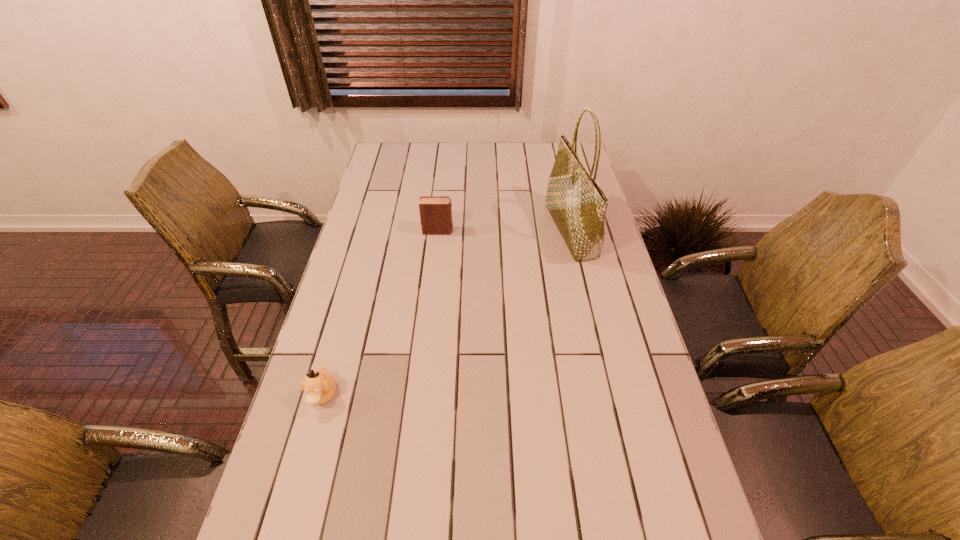
Where is `empty space between the diary and the tallest object`? empty space between the diary and the tallest object is located at coordinates (504, 231).

You are a GUI agent. You are given a task and a screenshot of the screen. Output one action in this format:
    pyautogui.click(x=<x>, y=<y>)
    Task: Click on the free spot between the duckling and the second tallest object
    
    Given the screenshot: What is the action you would take?
    pyautogui.click(x=380, y=313)

Where is `vacant area that lies between the shopping bag and the shortest object`? vacant area that lies between the shopping bag and the shortest object is located at coordinates 446,313.

Locate an element on the screen. The height and width of the screenshot is (540, 960). object that is the closest one to the rightmost object is located at coordinates (435, 212).

Select which object is the second closest to the nearest object. Please provide its 2D coordinates. Your answer should be formatted as a tuple, i.e. [(x, y)], where the tuple contains the x and y coordinates of a point satisfying the conditions above.

[(577, 203)]

I want to click on vacant space that satisfies the following two spatial constraints: 1. on the back side of the tallest object; 2. on the spine side of the diary, so click(x=570, y=231).

At what (x,y) coordinates should I click in order to perform the action: click on vacant space that satisfies the following two spatial constraints: 1. on the spine side of the diary; 2. on the right side of the shopping bag. Please return your answer as a coordinate pair (x, y). The image size is (960, 540). Looking at the image, I should click on (438, 231).

The height and width of the screenshot is (540, 960). What are the coordinates of `free space that satisfies the following two spatial constraints: 1. on the spine side of the diary; 2. on the left side of the shopping bag` in the screenshot? It's located at (438, 231).